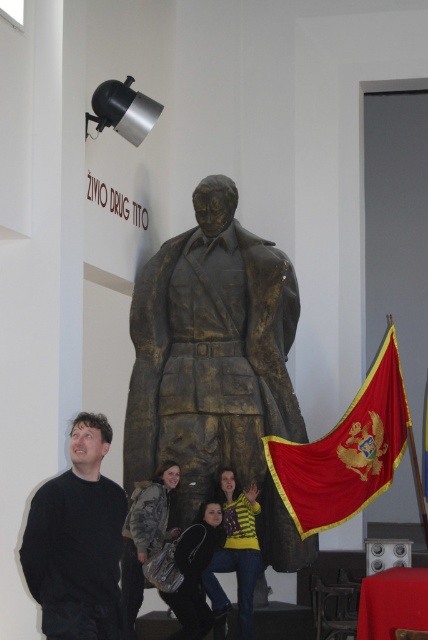
Is bronze statue at center thinner than camouflage fabric jacket at lower center?

Incorrect, bronze statue at center's width is not less than camouflage fabric jacket at lower center's.

Does bronze statue at center have a lesser height compared to camouflage fabric jacket at lower center?

No.

Is point (205, 456) closer to viewer compared to point (140, 492)?

That is False.

You are a GUI agent. You are given a task and a screenshot of the screen. Output one action in this format:
    pyautogui.click(x=<x>, y=<y>)
    Task: Click on the bronze statue at center
    The width and height of the screenshot is (428, 640).
    Given the screenshot: What is the action you would take?
    pyautogui.click(x=216, y=365)

Which is more to the left, bronze statue at center or black matte sweater at left?

black matte sweater at left

Where is `bronze statue at center`? The height and width of the screenshot is (640, 428). bronze statue at center is located at coordinates (216, 365).

This screenshot has height=640, width=428. Find the location of `yellow striped sweater at center`. yellow striped sweater at center is located at coordinates (235, 552).

Does yellow striped sweater at center lie behind black leather jacket at lower center?

Yes, yellow striped sweater at center is behind black leather jacket at lower center.

Is point (219, 566) less distant than point (175, 596)?

No, it is behind (175, 596).

You are a GUI agent. You are given a task and a screenshot of the screen. Output one action in this format:
    pyautogui.click(x=<x>, y=<y>)
    Task: Click on the yellow striped sweater at center
    Image resolution: width=428 pixels, height=640 pixels.
    Given the screenshot: What is the action you would take?
    pyautogui.click(x=235, y=552)